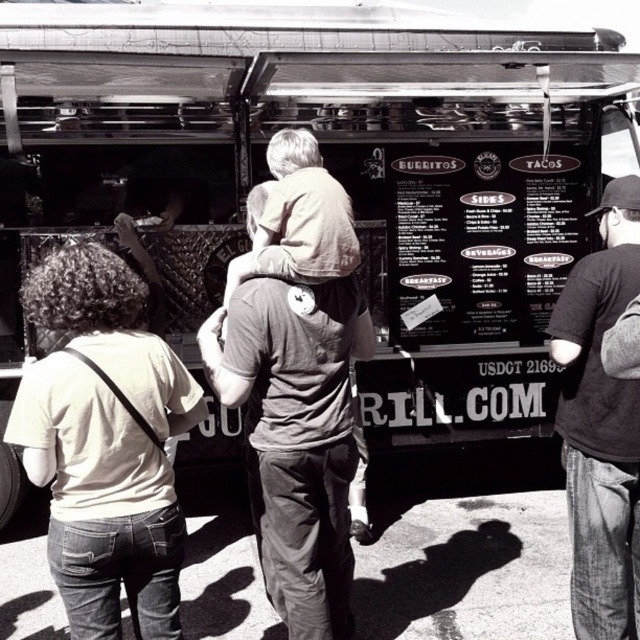
You are standing in front of the food truck and want to read the menu. Where exactly is the black matte menu board at center located?

The black matte menu board at center is located at point (481, 237).